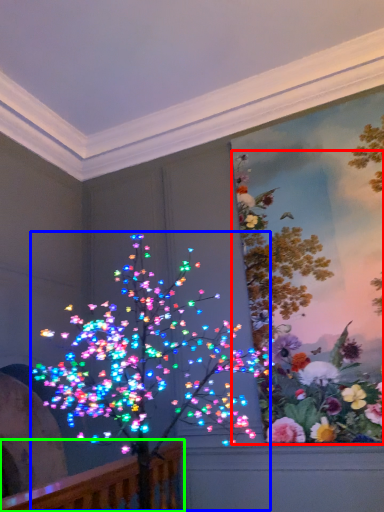
Question: Based on their relative distances, which object is nearer to floral arrangement (highlighted by a red box)? Choose from christmas decoration (highlighted by a blue box) and rail (highlighted by a green box).

Choices:
 (A) christmas decoration
 (B) rail

Answer: (A)